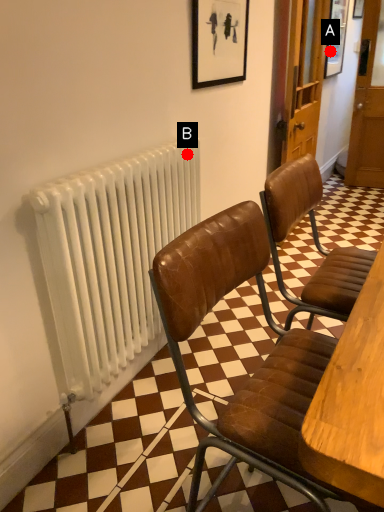
Question: Two points are circled on the image, labeled by A and B beside each circle. Which point is closer to the camera?

Choices:
 (A) A is closer
 (B) B is closer

Answer: (B)